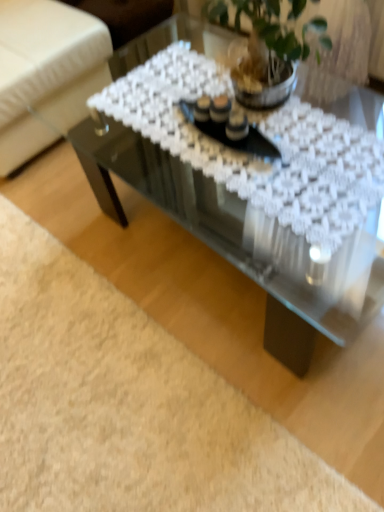
Question: Is white fabric armchair at upper left at the left side of transparent glass coffee table at center?

Choices:
 (A) no
 (B) yes

Answer: (B)

Question: Can you confirm if white fabric armchair at upper left is bigger than transparent glass coffee table at center?

Choices:
 (A) no
 (B) yes

Answer: (B)

Question: Considering the relative sizes of white fabric armchair at upper left and transparent glass coffee table at center in the image provided, is white fabric armchair at upper left smaller than transparent glass coffee table at center?

Choices:
 (A) no
 (B) yes

Answer: (A)

Question: Can you confirm if white fabric armchair at upper left is thinner than transparent glass coffee table at center?

Choices:
 (A) no
 (B) yes

Answer: (A)

Question: Does white fabric armchair at upper left have a lesser height compared to transparent glass coffee table at center?

Choices:
 (A) no
 (B) yes

Answer: (A)

Question: From the image's perspective, is white fabric armchair at upper left located beneath transparent glass coffee table at center?

Choices:
 (A) yes
 (B) no

Answer: (B)

Question: Does clear glass plate at center appear on the left side of transparent glass coffee table at center?

Choices:
 (A) no
 (B) yes

Answer: (B)

Question: Is transparent glass coffee table at center at the back of clear glass plate at center?

Choices:
 (A) no
 (B) yes

Answer: (A)

Question: From a real-world perspective, does clear glass plate at center stand above transparent glass coffee table at center?

Choices:
 (A) no
 (B) yes

Answer: (B)

Question: Is clear glass plate at center positioned before transparent glass coffee table at center?

Choices:
 (A) yes
 (B) no

Answer: (B)

Question: Is clear glass plate at center at the right side of transparent glass coffee table at center?

Choices:
 (A) no
 (B) yes

Answer: (A)

Question: From the image's perspective, is clear glass plate at center below transparent glass coffee table at center?

Choices:
 (A) no
 (B) yes

Answer: (A)

Question: Can you confirm if transparent glass coffee table at center is wider than white fabric armchair at upper left?

Choices:
 (A) yes
 (B) no

Answer: (B)